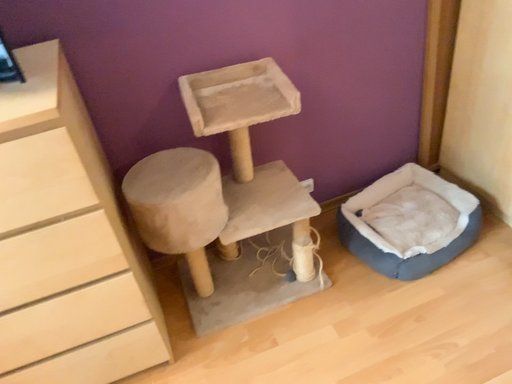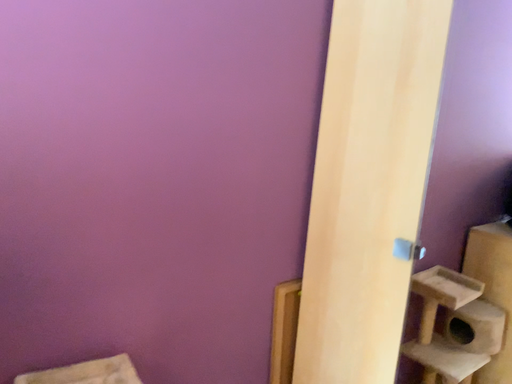
Question: Which way did the camera rotate in the video?

Choices:
 (A) rotated upward
 (B) rotated downward

Answer: (A)